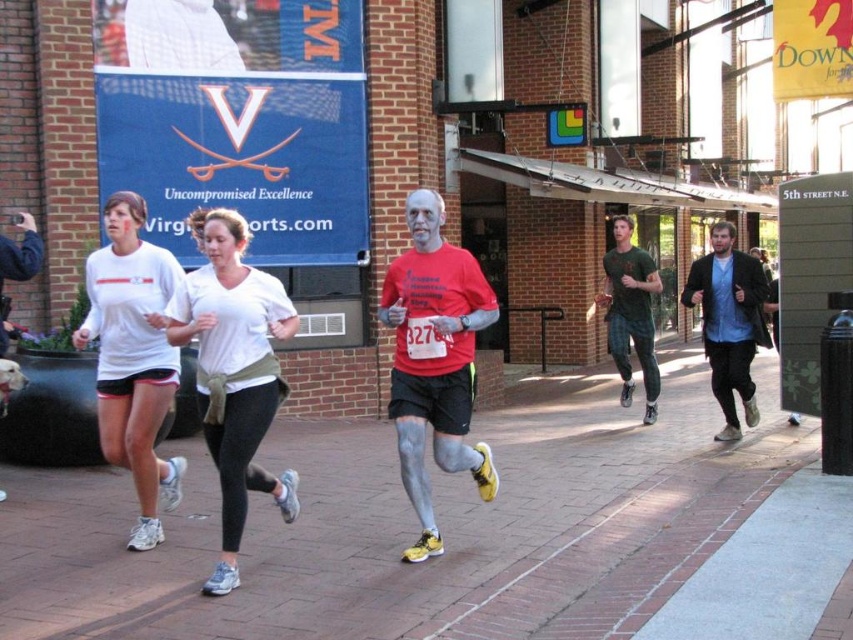
Is brick pavement at center to the left of blue cotton shirt at right from the viewer's perspective?

Correct, you'll find brick pavement at center to the left of blue cotton shirt at right.

Who is more forward, (202, 474) or (715, 260)?

Positioned in front is point (202, 474).

This screenshot has width=853, height=640. What do you see at coordinates (415, 529) in the screenshot? I see `brick pavement at center` at bounding box center [415, 529].

The width and height of the screenshot is (853, 640). I want to click on brick pavement at center, so click(415, 529).

Between brick pavement at center and white matte t-shirt at left, which one is positioned lower?

Positioned lower is brick pavement at center.

Is brick pavement at center closer to the viewer compared to white matte t-shirt at left?

That is False.

This screenshot has width=853, height=640. Identify the location of brick pavement at center. (415, 529).

Based on the photo, does blue cotton shirt at right have a lesser height compared to green matte t-shirt at center?

Yes.

Is blue cotton shirt at right behind green matte t-shirt at center?

No, it is in front of green matte t-shirt at center.

Which is in front, point (727, 387) or point (630, 275)?

Point (727, 387) is more forward.

The image size is (853, 640). Identify the location of blue cotton shirt at right. (729, 323).